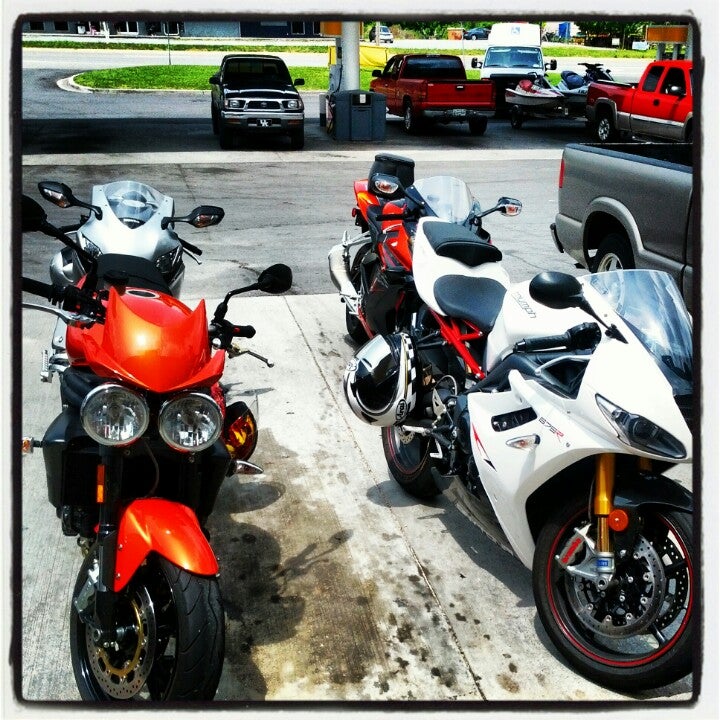
Image resolution: width=720 pixels, height=720 pixels. I want to click on white cylindrical pillars, so click(350, 66), click(690, 53).